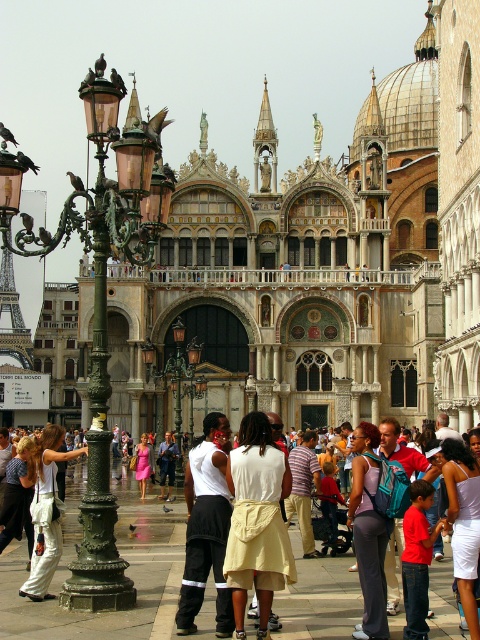
Question: Which of the following is the farthest from the observer?

Choices:
 (A) (168, 448)
 (B) (374, 477)
 (C) (469, 461)

Answer: (A)

Question: Which point is farther to the camera?

Choices:
 (A) matte purple tank top at center
 (B) white cotton pants at lower left
 (C) white satin dress at center

Answer: (B)

Question: Is green patinated metal streetlight at left smaller than striped cotton shirt at center?

Choices:
 (A) yes
 (B) no

Answer: (B)

Question: Is white satin dress at center bigger than green ornate lamp post at center?

Choices:
 (A) no
 (B) yes

Answer: (A)

Question: Can you confirm if green patinated metal streetlight at left is smaller than striped cotton shirt at center?

Choices:
 (A) no
 (B) yes

Answer: (A)

Question: Which object is the farthest from the striped cotton shirt at center?

Choices:
 (A) pink satin dress at center
 (B) white satin dress at center
 (C) green patinated metal streetlight at left

Answer: (C)